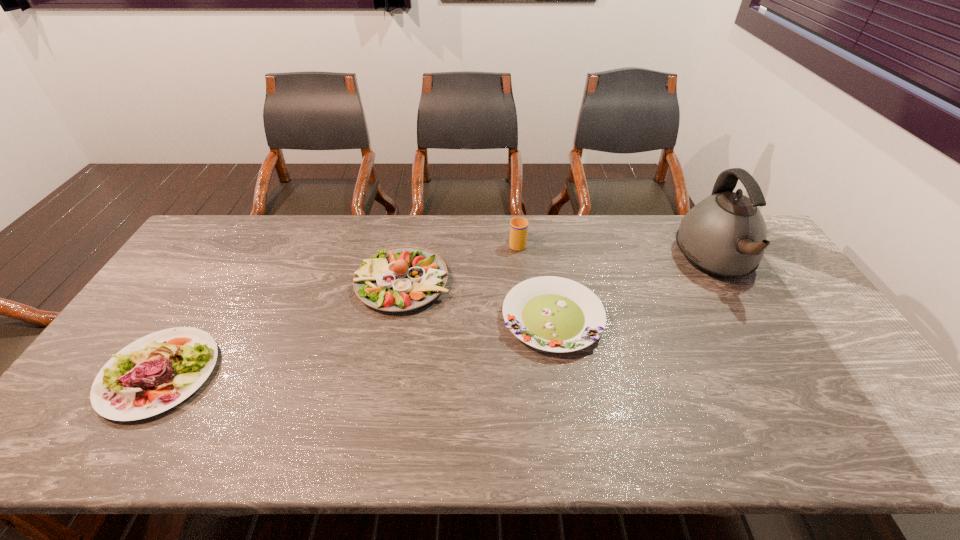
At what (x,y) coordinates should I click in order to perform the action: click on object that is at the left edge. Please return your answer as a coordinate pair (x, y). The image size is (960, 540). Looking at the image, I should click on (129, 386).

Image resolution: width=960 pixels, height=540 pixels. What are the coordinates of `object that is at the right edge` in the screenshot? It's located at (724, 236).

You are a GUI agent. You are given a task and a screenshot of the screen. Output one action in this format:
    pyautogui.click(x=<x>, y=<y>)
    Task: Click on the object that is at the near left corner
    Image resolution: width=960 pixels, height=540 pixels.
    Given the screenshot: What is the action you would take?
    pyautogui.click(x=129, y=386)

Find the location of a particular element. This screenshot has height=540, width=960. object that is at the far right corner is located at coordinates (724, 236).

In the image, there is a desktop. What are the coordinates of `vacant space at the far edge` in the screenshot? It's located at (487, 243).

At what (x,y) coordinates should I click in order to perform the action: click on vacant space at the near edge. Please return your answer as a coordinate pair (x, y). Looking at the image, I should click on (798, 453).

The image size is (960, 540). In order to click on vacant space at the right edge of the desktop in this screenshot , I will do `click(839, 348)`.

This screenshot has width=960, height=540. Identify the location of vacant position at the near left corner of the desktop. (76, 430).

I want to click on vacant region between the rightmost salad plate and the rightmost object, so click(x=635, y=290).

Image resolution: width=960 pixels, height=540 pixels. Identify the location of blank region between the tallest object and the cup. (616, 253).